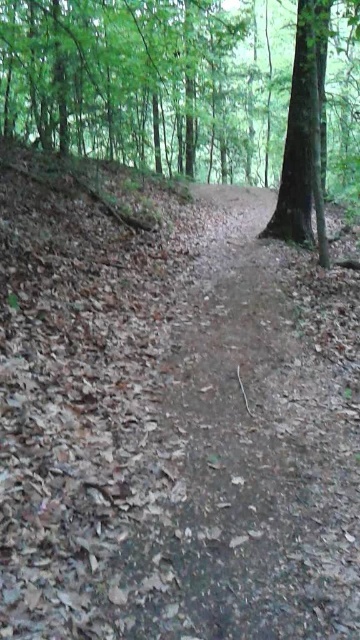
Question: Is green leafy tree at upper center further to camera compared to green rough bark tree at upper right?

Choices:
 (A) no
 (B) yes

Answer: (B)

Question: Does green leafy tree at upper center appear on the left side of green rough bark tree at upper right?

Choices:
 (A) yes
 (B) no

Answer: (B)

Question: Does green leafy tree at upper center have a smaller size compared to green rough bark tree at upper right?

Choices:
 (A) no
 (B) yes

Answer: (B)